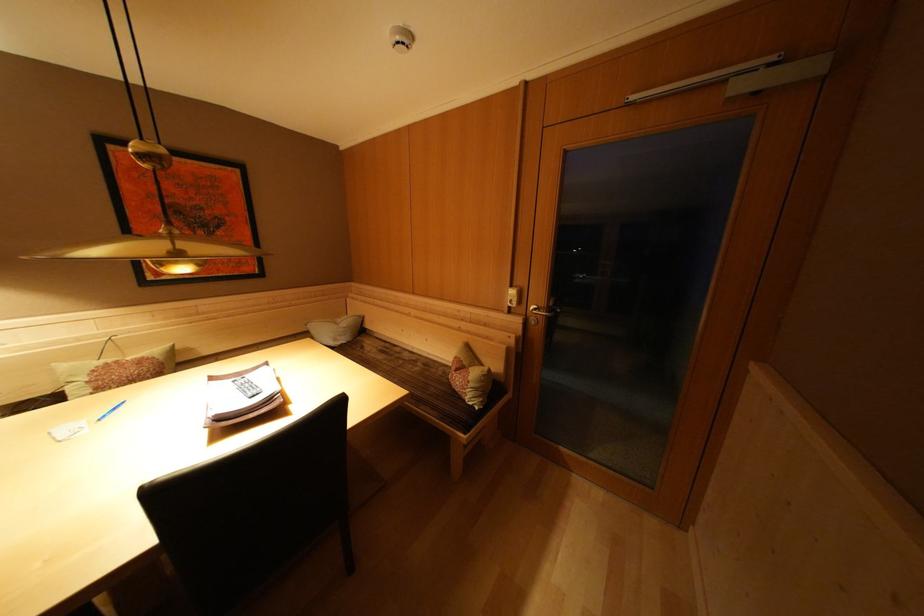
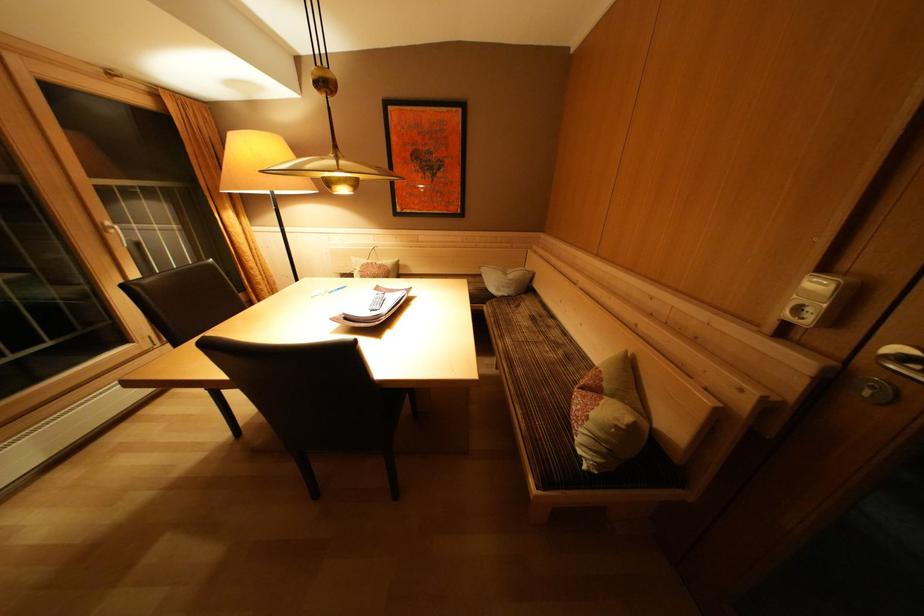
Find the pixel in the second image that matches [124,367] in the first image.

(379, 268)